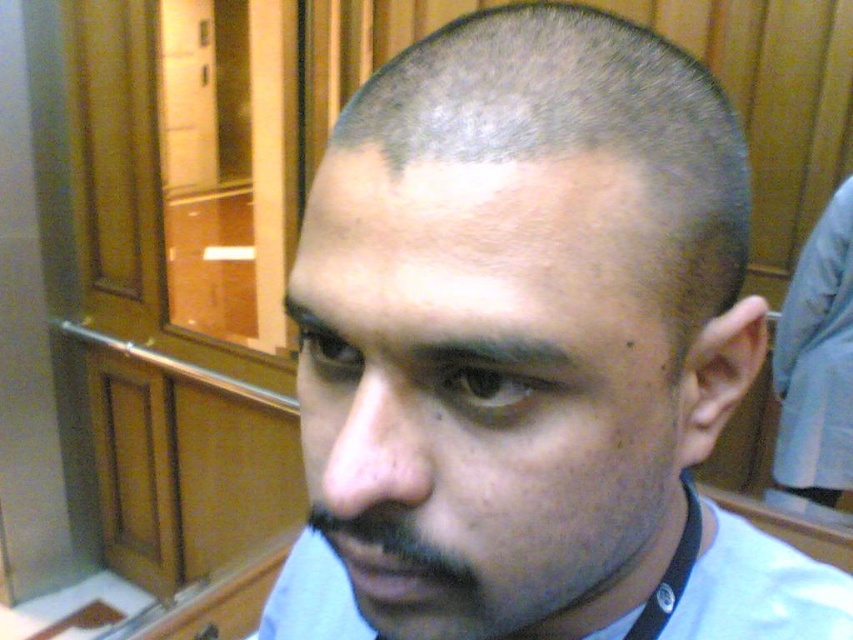
You are a fashion designer observing a model wearing the light blue shirt at center and the black fabric neckband at lower right. Which item of clothing is bigger in size?

The light blue shirt at center is larger in size than the black fabric neckband at lower right.

You are an artist sketching the person in the image. You need to decide which object to draw first based on their size. Which one should you start with, the gray matte hair at upper center or the black fabric neckband at lower right?

The gray matte hair at upper center is larger in size than the black fabric neckband at lower right, so you should start drawing the gray matte hair at upper center first.